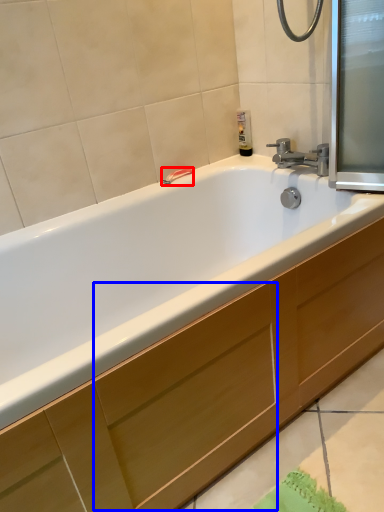
Question: Among these objects, which one is nearest to the camera, towel bar (highlighted by a red box) or drawer (highlighted by a blue box)?

Choices:
 (A) towel bar
 (B) drawer

Answer: (B)